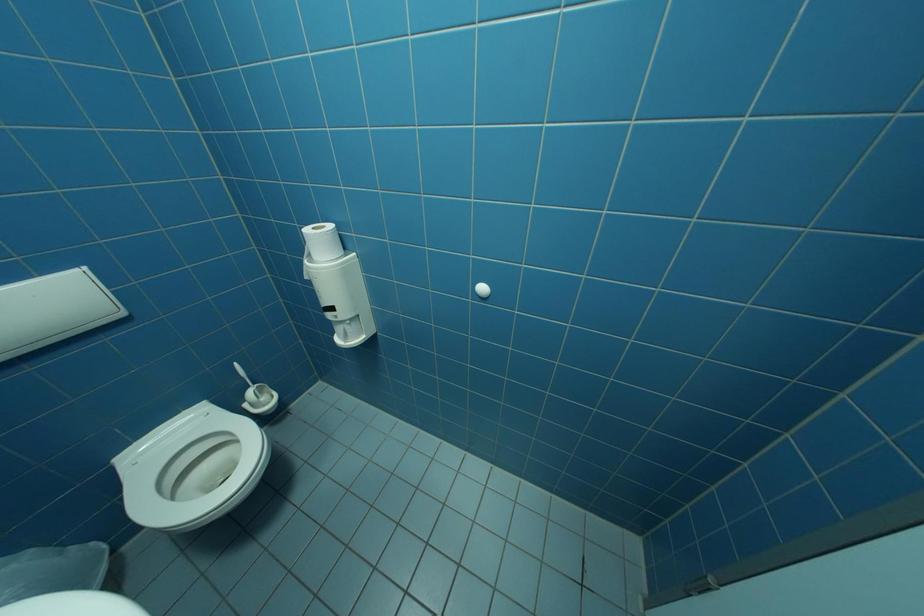
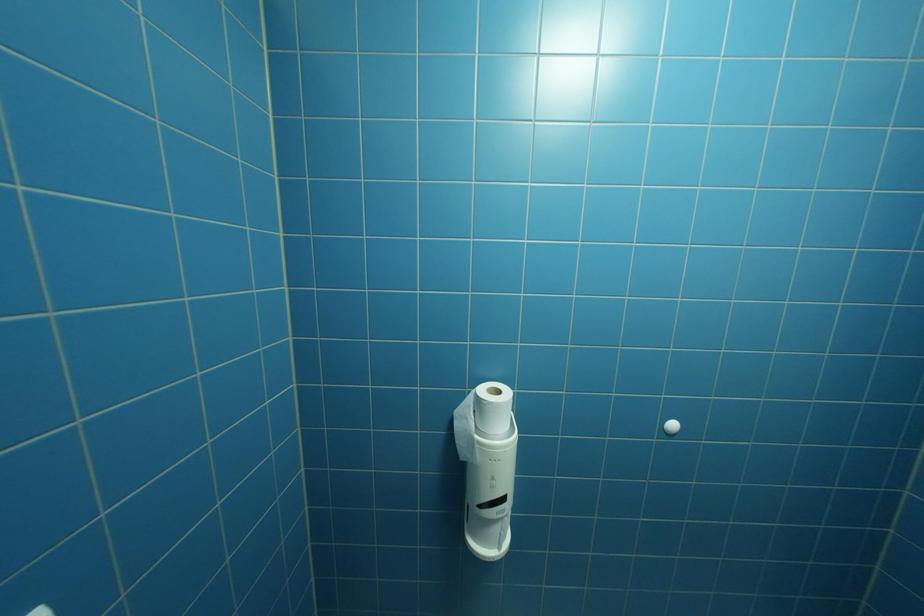
First-person continuous shooting, in which direction is the camera rotating?

The rotation direction of the camera is right-up.